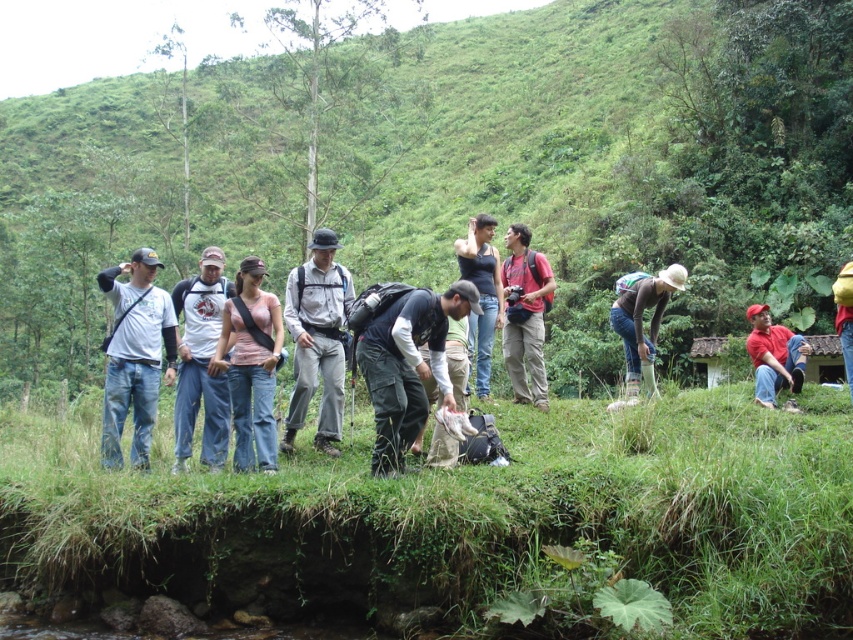
Between dark gray fabric backpack at center and denim jeans at center, which one appears on the left side from the viewer's perspective?

dark gray fabric backpack at center

Find the location of a particular element. The width and height of the screenshot is (853, 640). dark gray fabric backpack at center is located at coordinates (407, 365).

Who is lower down, light brown fabric shirt at center or matte black tank top at center?

light brown fabric shirt at center is below.

Who is shorter, light brown fabric shirt at center or matte black tank top at center?

matte black tank top at center is shorter.

Which is behind, point (303, 394) or point (479, 266)?

Point (479, 266)

The width and height of the screenshot is (853, 640). I want to click on light brown fabric shirt at center, so click(x=317, y=340).

Image resolution: width=853 pixels, height=640 pixels. What do you see at coordinates (201, 362) in the screenshot?
I see `white cotton shirt at center` at bounding box center [201, 362].

Which is in front, point (181, 349) or point (634, 305)?

Point (181, 349) is more forward.

You are a GUI agent. You are given a task and a screenshot of the screen. Output one action in this format:
    pyautogui.click(x=<x>, y=<y>)
    Task: Click on the white cotton shirt at center
    Image resolution: width=853 pixels, height=640 pixels.
    Given the screenshot: What is the action you would take?
    pos(201,362)